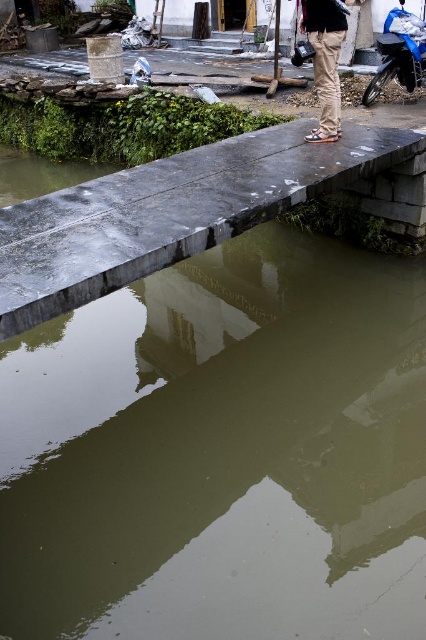
Question: Which object appears closest to the camera in this image?

Choices:
 (A) khaki cotton pants at center
 (B) blue matte motorcycle at upper right

Answer: (A)

Question: Among these points, which one is nearest to the camera?

Choices:
 (A) (388, 38)
 (B) (399, 378)
 (C) (307, 26)

Answer: (B)

Question: Is greenish murky water at center wider than khaki cotton pants at center?

Choices:
 (A) no
 (B) yes

Answer: (B)

Question: Which of the following is the farthest from the observer?

Choices:
 (A) (337, 116)
 (B) (362, 97)

Answer: (B)

Question: Does khaki cotton pants at center have a greater width compared to blue matte motorcycle at upper right?

Choices:
 (A) no
 (B) yes

Answer: (A)

Question: Is greenish murky water at center to the right of khaki cotton pants at center from the viewer's perspective?

Choices:
 (A) no
 (B) yes

Answer: (A)